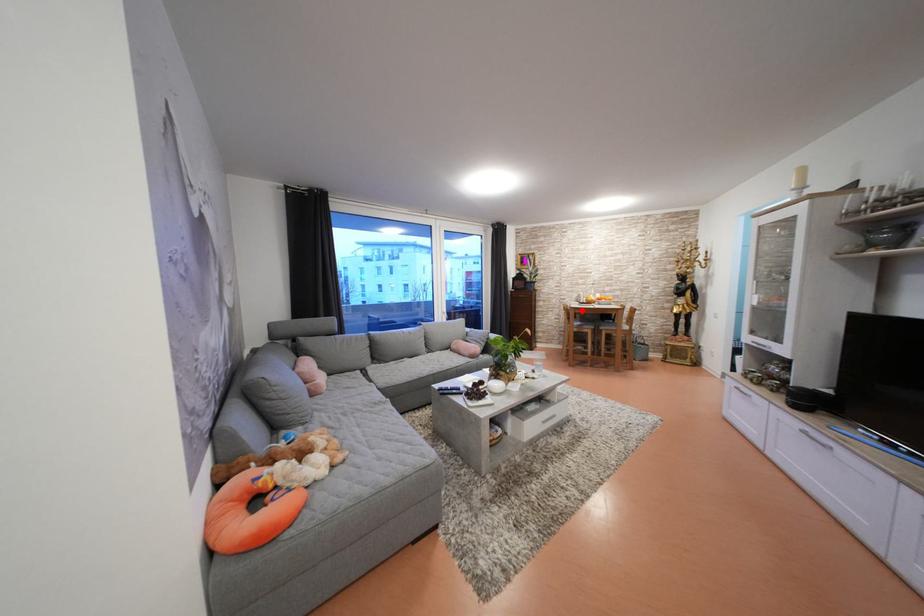
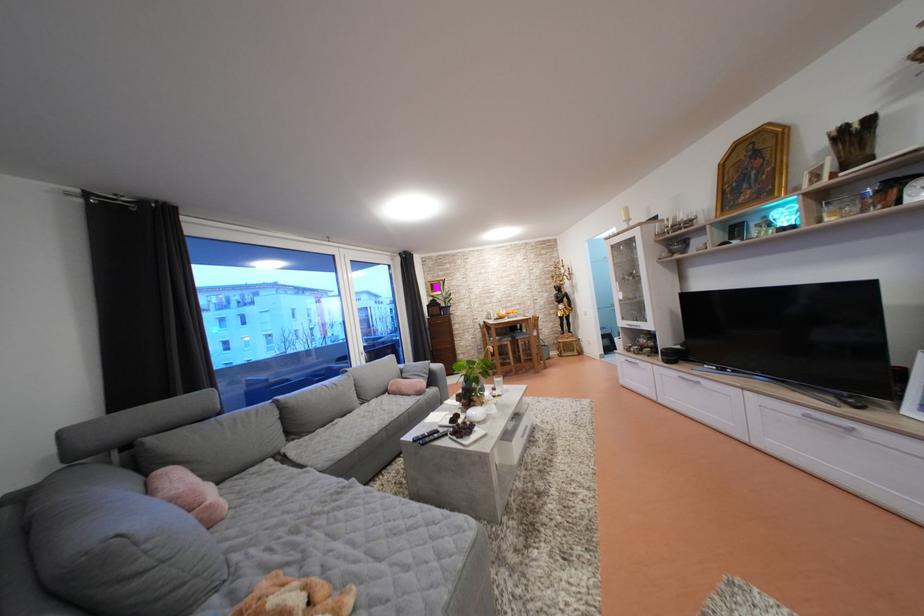
The point at the highlighted location is marked in the first image. Where is the corresponding point in the second image?

(497, 328)